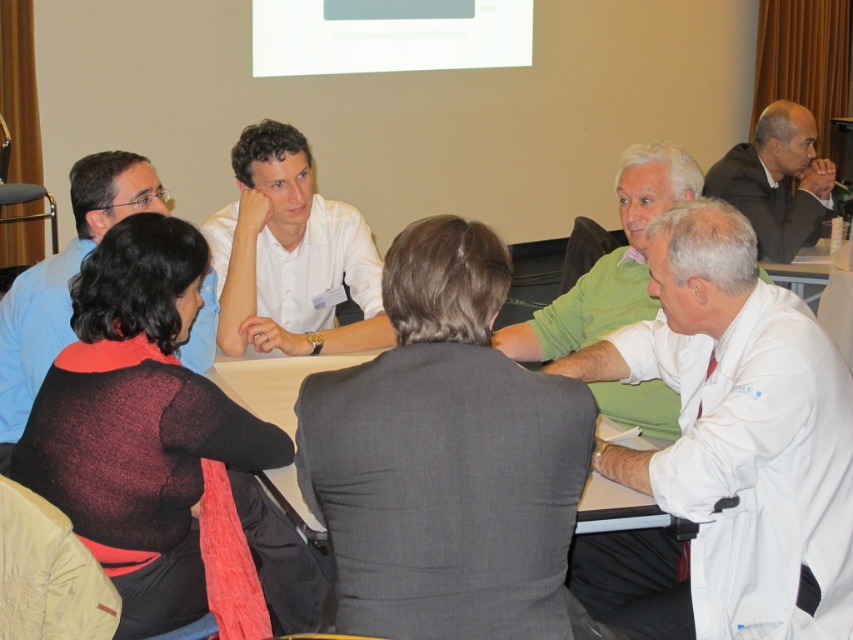
You are organizing a photo shoot and need to ensure that the white smooth shirt at center and the white plastic table at center are clearly visible in the frame. Given their sizes, which object should you focus on first to ensure proper lighting?

The white smooth shirt at center is bigger than the white plastic table at center, so you should focus on lighting the white smooth shirt at center first to ensure its details are captured properly.

In the scene shown: Where is the white smooth shirt at center located in the image?

The white smooth shirt at center is located at point (292, 252).

From the picture: You are organizing a photo shoot and need to arrange two models based on their clothing. The models are wearing the white matte shirt at center and the dark gray suit at upper right. Which model should you place on the left side if you want the thinner clothing to be on the left?

The white matte shirt at center is thinner than the dark gray suit at upper right, so you should place the model wearing the white matte shirt at center on the left side.